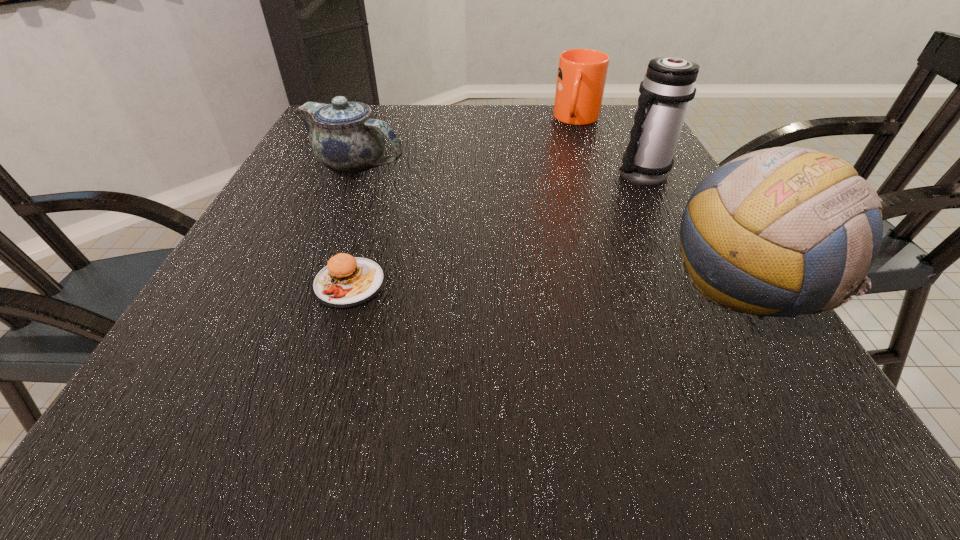
At what (x,y) coordinates should I click in order to perform the action: click on vacant point located between the chinaware and the volleyball. Please return your answer as a coordinate pair (x, y). Image resolution: width=960 pixels, height=540 pixels. Looking at the image, I should click on (549, 226).

This screenshot has height=540, width=960. Identify the location of vacant region between the patty and the thermos bottle. (494, 230).

Find the location of a particular element. Image resolution: width=960 pixels, height=540 pixels. free space between the volleyball and the mug is located at coordinates (660, 202).

Find the location of a particular element. The height and width of the screenshot is (540, 960). vacant space in between the thermos bottle and the shortest object is located at coordinates (494, 230).

Where is `unoccupied position between the thermos bottle and the patty`? unoccupied position between the thermos bottle and the patty is located at coordinates (494, 230).

Locate an element on the screen. empty location between the shortest object and the mug is located at coordinates (464, 201).

Identify which object is located as the nearest to the thermos bottle. Please provide its 2D coordinates. Your answer should be formatted as a tuple, i.e. [(x, y)], where the tuple contains the x and y coordinates of a point satisfying the conditions above.

[(581, 77)]

Locate an element on the screen. This screenshot has width=960, height=540. object identified as the fourth closest to the chinaware is located at coordinates (791, 224).

Where is `free space in the image that satisfies the following two spatial constraints: 1. on the front side of the volleyball; 2. on the right side of the patty`? Image resolution: width=960 pixels, height=540 pixels. free space in the image that satisfies the following two spatial constraints: 1. on the front side of the volleyball; 2. on the right side of the patty is located at coordinates (349, 286).